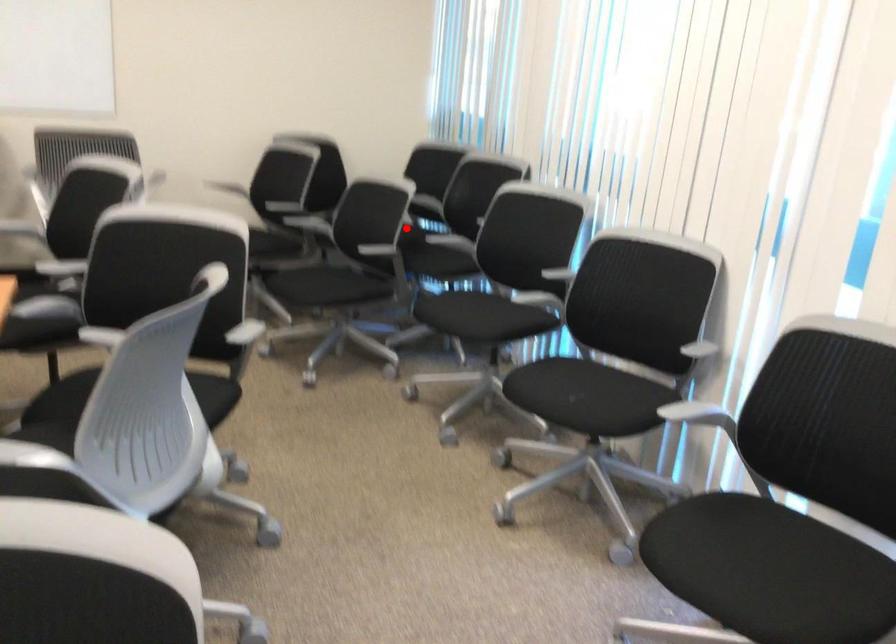
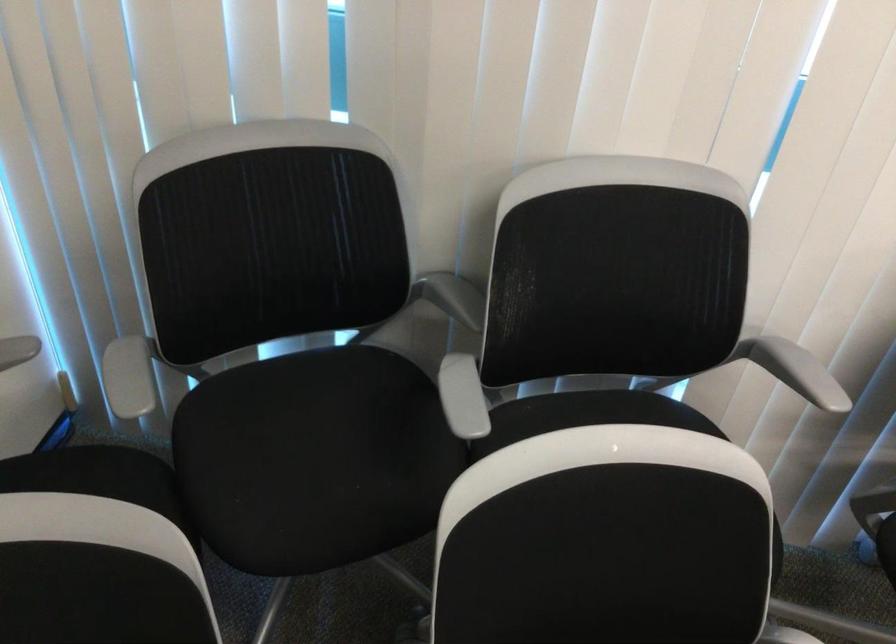
Question: I am providing you with two images of the same scene from different viewpoints. Given a red point in image1, look at the same physical point in image2. Is it:

Choices:
 (A) Closer to the viewpoint
 (B) Farther from the viewpoint

Answer: (A)